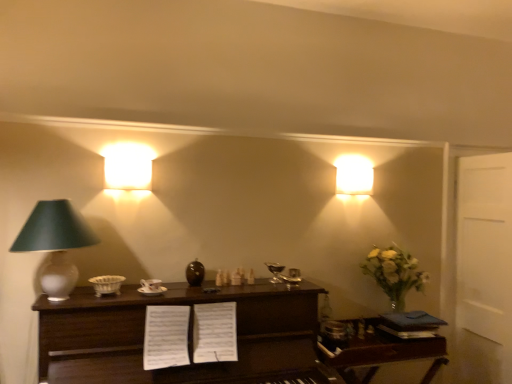
You are a GUI agent. You are given a task and a screenshot of the screen. Output one action in this format:
    pyautogui.click(x=<x>, y=<y>)
    Task: Click on the free spot above matte white square light at upper right, placed as the 3th lamp when sorted from left to right (from a real-world perspective)
    Image resolution: width=512 pixels, height=384 pixels.
    Given the screenshot: What is the action you would take?
    pyautogui.click(x=354, y=169)